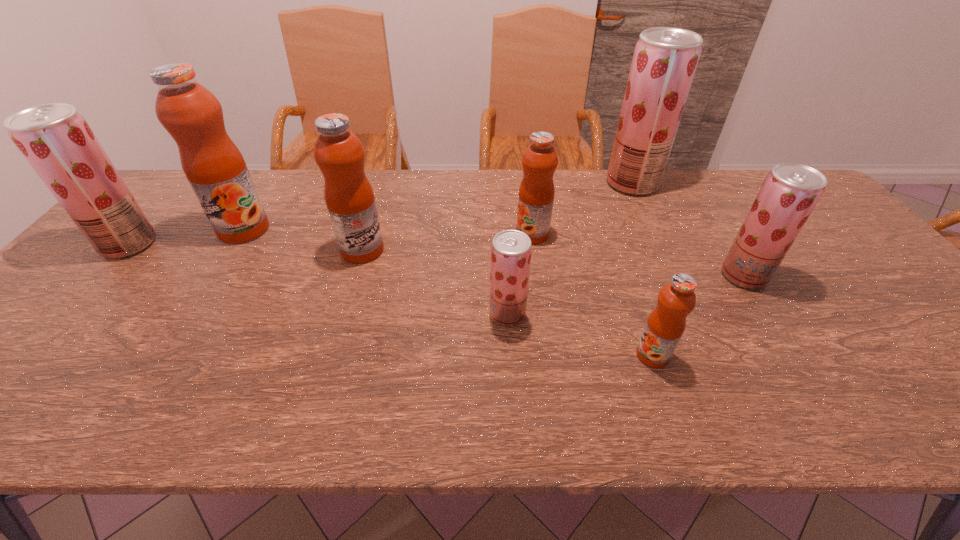
Image resolution: width=960 pixels, height=540 pixels. In the image, there is a desktop. Identify the location of vacant space at the near edge. [x=524, y=402].

Image resolution: width=960 pixels, height=540 pixels. Find the location of `free point between the second nearest fruit juice and the second orange fruit juice from left to right`. free point between the second nearest fruit juice and the second orange fruit juice from left to right is located at coordinates (435, 282).

The width and height of the screenshot is (960, 540). In order to click on free point between the second biggest orange fruit juice and the second object from right to left in this screenshot , I will do `click(497, 217)`.

Where is `empty space between the leftmost orange fruit juice and the third biggest orange fruit juice`? The width and height of the screenshot is (960, 540). empty space between the leftmost orange fruit juice and the third biggest orange fruit juice is located at coordinates (388, 232).

Where is `empty location between the second fruit juice from left to right and the second biggest strawberry fruit juice`? empty location between the second fruit juice from left to right and the second biggest strawberry fruit juice is located at coordinates (186, 237).

Find the location of a particular element. This screenshot has width=960, height=540. free space between the rightmost object and the second biggest strawberry fruit juice is located at coordinates (437, 260).

Image resolution: width=960 pixels, height=540 pixels. Identify the location of free spot between the second smallest strawberry fruit juice and the third orange fruit juice from left to right. (638, 255).

Where is `empty space between the nearest object and the second orange fruit juice from right to left`? The width and height of the screenshot is (960, 540). empty space between the nearest object and the second orange fruit juice from right to left is located at coordinates (592, 295).

Locate an element on the screen. object that stands as the fifth closest to the leftmost fruit juice is located at coordinates (665, 326).

Identify which object is the seventh closest to the third biggest orange fruit juice. Please provide its 2D coordinates. Your answer should be formatted as a tuple, i.e. [(x, y)], where the tuple contains the x and y coordinates of a point satisfying the conditions above.

[(56, 140)]